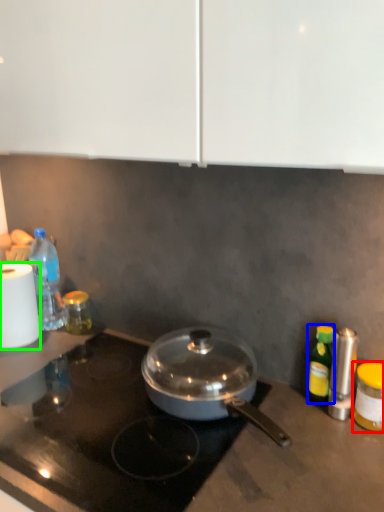
Question: Based on their relative distances, which object is nearer to bottle (highlighted by a red box)? Choose from bottle (highlighted by a blue box) and paper towel (highlighted by a green box).

Choices:
 (A) bottle
 (B) paper towel

Answer: (A)